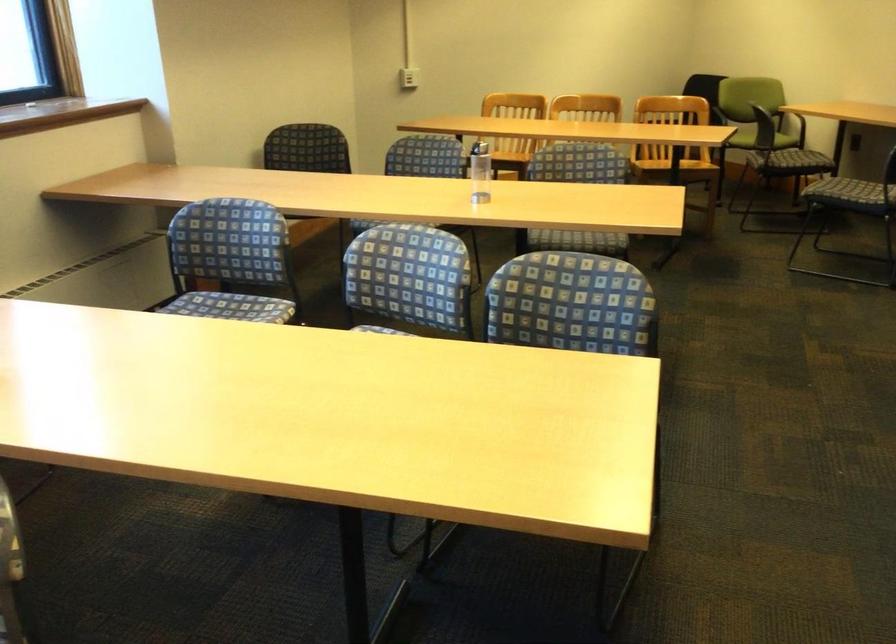
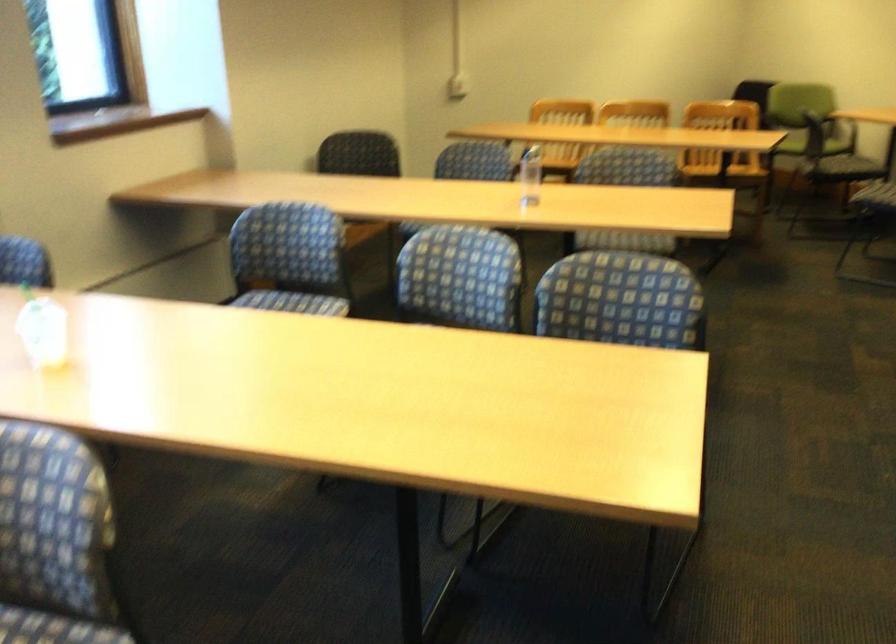
Where in the second image is the point corresponding to [409,278] from the first image?

(460, 277)